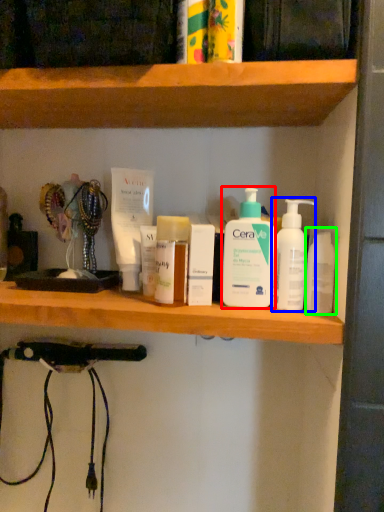
Question: Which object is the farthest from cleaning product (highlighted by a red box)? Choose among these: cleaning product (highlighted by a blue box) or mouthwash (highlighted by a green box).

Choices:
 (A) cleaning product
 (B) mouthwash

Answer: (B)